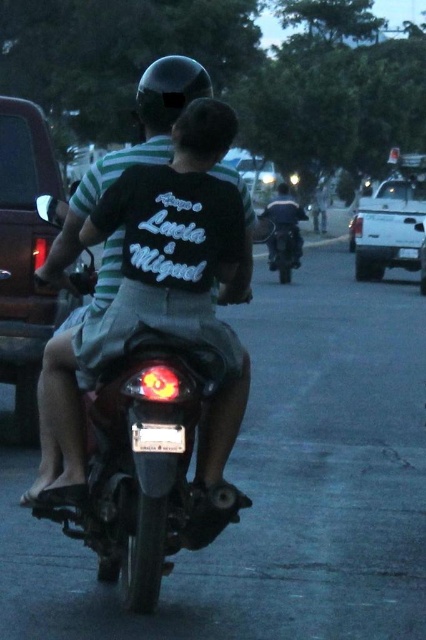
You are a traffic officer observing a motorcycle ride on a street with a red pickup truck to the left and a white pickup truck ahead. You notice two motorcycles at the center of the scene. Which motorcycle is thinner between the matte black motorcycle at center and the shiny black motorcycle at center?

The matte black motorcycle at center is thinner than the shiny black motorcycle at center.

You are a pedestrian standing on the sidewalk. You see the matte black motorcycle at center and the white matte pickup truck at upper right. Which vehicle is closer to the ground?

The matte black motorcycle at center is shorter than the white matte pickup truck at upper right, so the matte black motorcycle at center is closer to the ground.

You are a photographer trying to capture the motorcycle riders at dusk. You notice two motorcycles at the center of the image. Which motorcycle is closer to the camera, the matte black motorcycle at center or the shiny black motorcycle at center?

The shiny black motorcycle at center is closer to the camera because the matte black motorcycle at center is positioned under it, meaning it is behind.